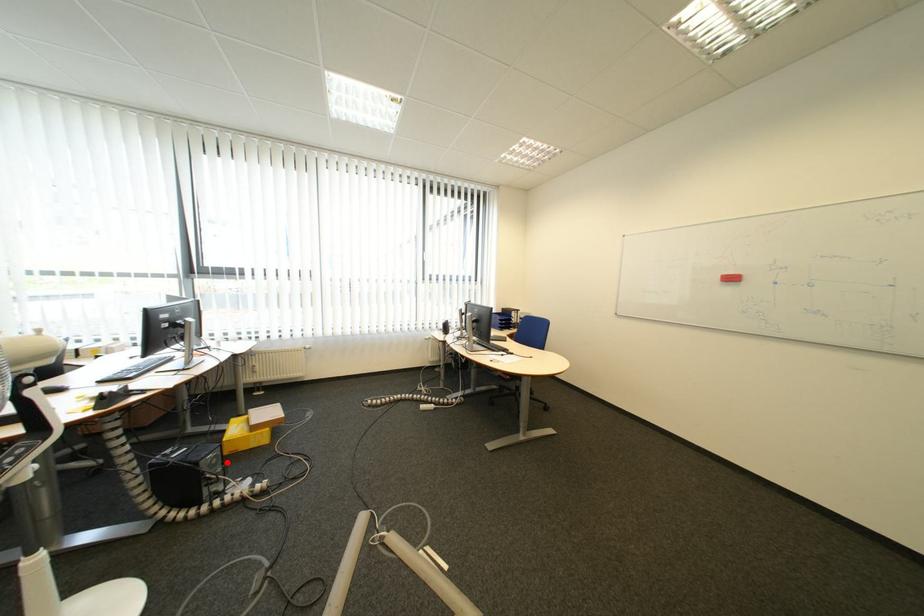
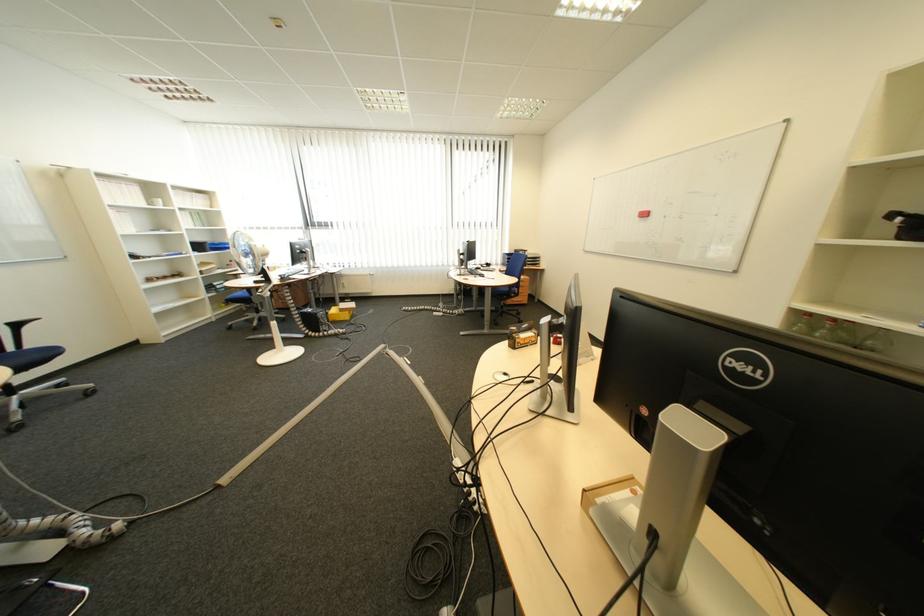
Where in the second image is the point corresponding to the highlighted location from the first image?

(335, 317)